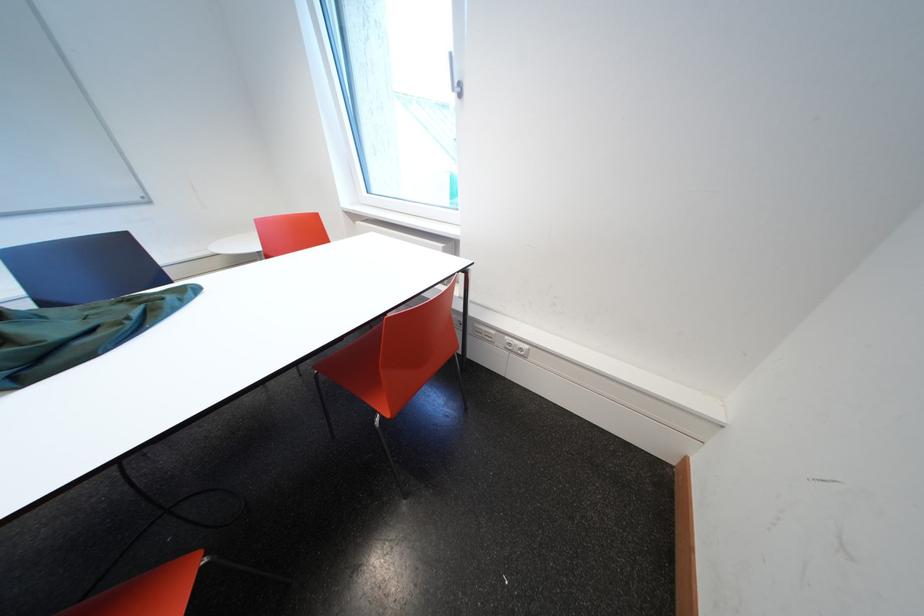
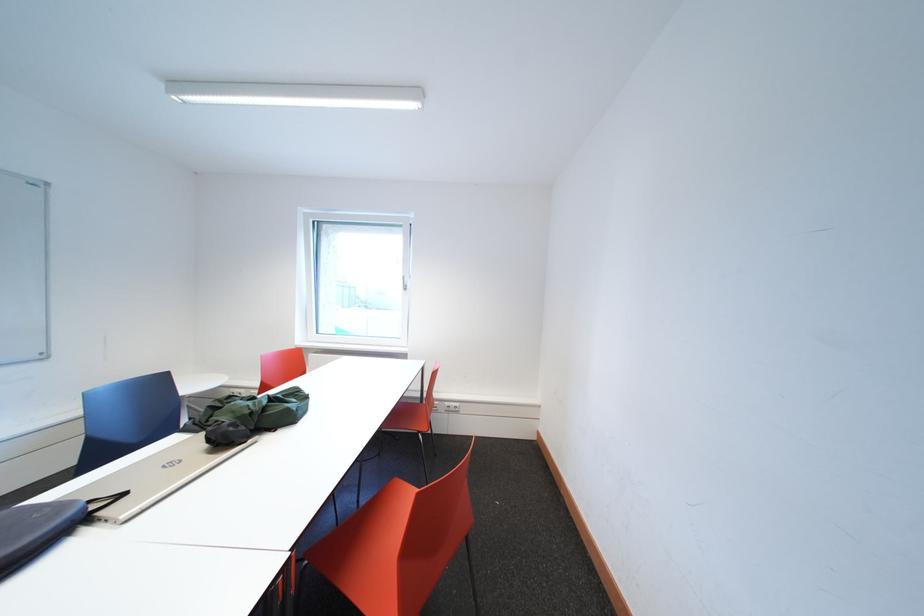
Locate, in the second image, the point that corresponds to [343,442] in the first image.

(368, 506)